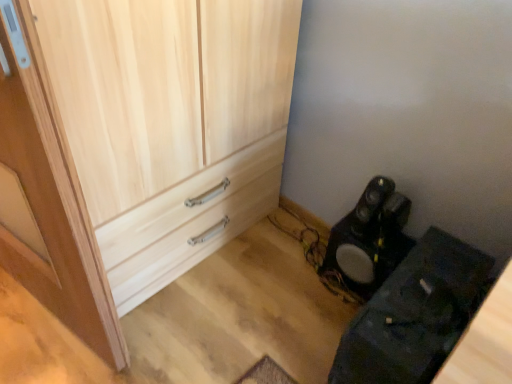
Where is `vacant area that lies between natural wood cupboard at center and black matte speaker at lower right`? The height and width of the screenshot is (384, 512). vacant area that lies between natural wood cupboard at center and black matte speaker at lower right is located at coordinates (264, 281).